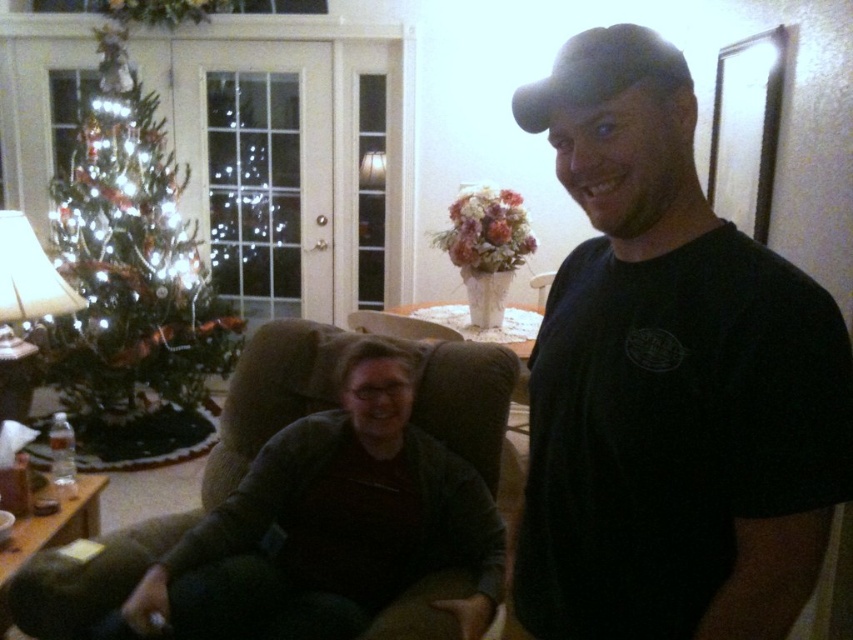
In the holiday living room scene, there is a green matte christmas tree at left and a brown fabric couch at lower left. Which object takes up more space in the image?

The green matte christmas tree at left is bigger than the brown fabric couch at lower left, so it takes up more space in the image.

You are planning to place a new coffee table in the living room. The coffee table needs to be positioned between the green matte christmas tree at left and the brown fabric couch at lower left. Based on their positions, which object should the coffee table be closer to?

The brown fabric couch at lower left is behind the green matte christmas tree at left, so the coffee table should be placed closer to the green matte christmas tree at left to ensure proper spacing between the two objects.